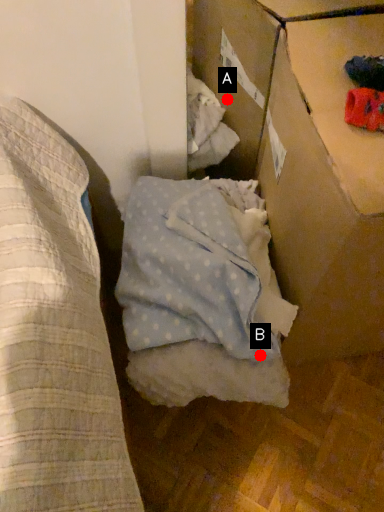
Question: Two points are circled on the image, labeled by A and B beside each circle. Which point appears closest to the camera in this image?

Choices:
 (A) A is closer
 (B) B is closer

Answer: (B)